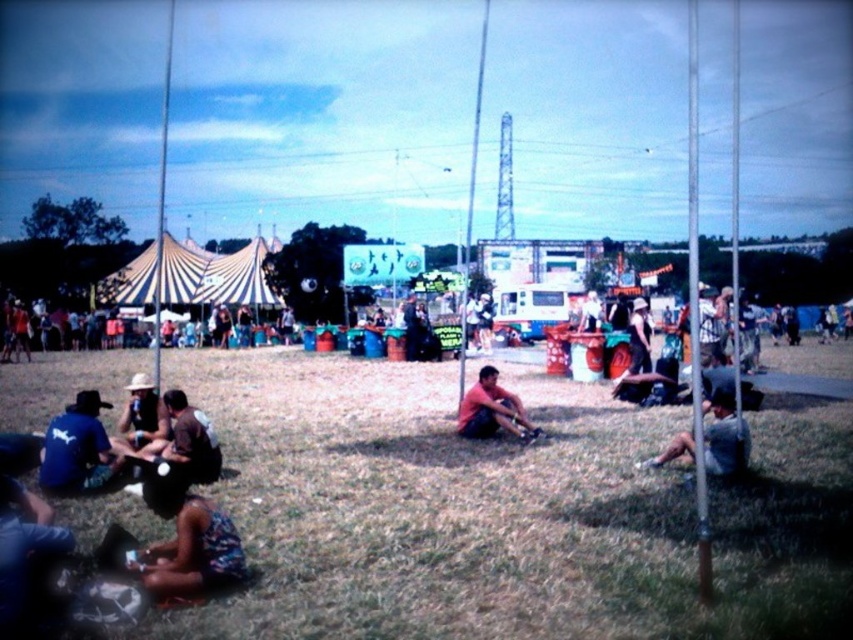
You are a photographer at the festival and want to take a photo of the floral dress at lower left and the matte brown hat at lower left. Since you need to adjust your camera settings based on their widths, which object should you focus on first if you want to capture the wider object in the frame?

The matte brown hat at lower left is wider than the floral dress at lower left, so you should focus on the matte brown hat at lower left first to capture the wider object.

You are at the festival and want to take a photo of both the matte red shirt at center and the matte brown hat at lower left. Which object should you focus on first to ensure both are in the frame?

You should focus on the matte red shirt at center first because it is closer to you than the matte brown hat at lower left, ensuring both are in the frame.